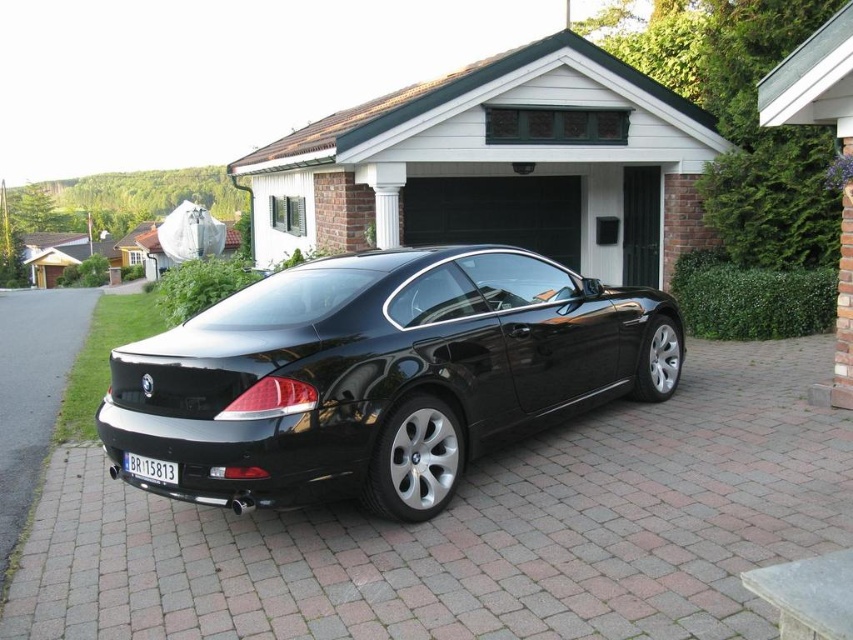
Question: Is glossy black car at center closer to camera compared to brick paved driveway at lower left?

Choices:
 (A) no
 (B) yes

Answer: (B)

Question: Is glossy black car at center below brick paved driveway at lower left?

Choices:
 (A) yes
 (B) no

Answer: (A)

Question: Which object is the closest to the white plastic license plate at center?

Choices:
 (A) green wood garage door at center
 (B) brick paved driveway at lower left

Answer: (B)

Question: Which point is farther from the camera taking this photo?

Choices:
 (A) (296, 280)
 (B) (161, 461)
 (C) (177, 561)

Answer: (A)

Question: Can you confirm if glossy black car at center is bigger than white plastic license plate at center?

Choices:
 (A) yes
 (B) no

Answer: (A)

Question: Among these points, which one is farthest from the camera?

Choices:
 (A) (132, 452)
 (B) (247, 308)
 (C) (608, 177)

Answer: (C)